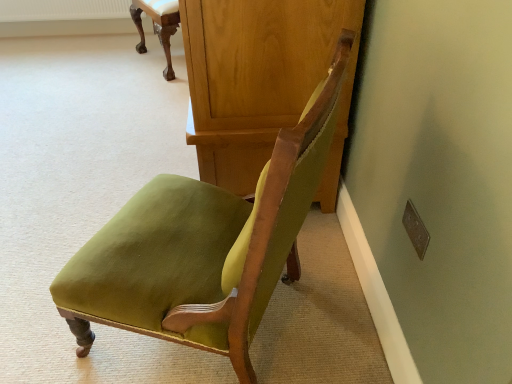
Question: Can you confirm if matte green fabric chair at upper center, which ranks as the 1th chair in back-to-front order, is taller than wooden dresser at center?

Choices:
 (A) yes
 (B) no

Answer: (B)

Question: Is matte green fabric chair at upper center, the second chair from the bottom, far from wooden dresser at center?

Choices:
 (A) yes
 (B) no

Answer: (A)

Question: Considering the relative positions of matte green fabric chair at upper center, which ranks as the 1th chair in back-to-front order, and wooden dresser at center in the image provided, is matte green fabric chair at upper center, which ranks as the 1th chair in back-to-front order, to the right of wooden dresser at center from the viewer's perspective?

Choices:
 (A) no
 (B) yes

Answer: (A)

Question: Is wooden dresser at center a part of matte green fabric chair at upper center, the first chair when ordered from top to bottom?

Choices:
 (A) yes
 (B) no

Answer: (B)

Question: From a real-world perspective, is matte green fabric chair at upper center, the first chair when ordered from top to bottom, located beneath wooden dresser at center?

Choices:
 (A) no
 (B) yes

Answer: (B)

Question: Considering the positions of wooden dresser at center and matte green fabric chair at upper center, the first chair when ordered from top to bottom, in the image, is wooden dresser at center wider or thinner than matte green fabric chair at upper center, the first chair when ordered from top to bottom,?

Choices:
 (A) wide
 (B) thin

Answer: (A)

Question: Based on their positions, is wooden dresser at center located to the left or right of matte green fabric chair at upper center, the second chair from the bottom?

Choices:
 (A) right
 (B) left

Answer: (A)

Question: In terms of size, does wooden dresser at center appear bigger or smaller than matte green fabric chair at upper center, acting as the 2th chair starting from the front?

Choices:
 (A) big
 (B) small

Answer: (A)

Question: Is wooden dresser at center situated inside matte green fabric chair at upper center, the second chair from the bottom, or outside?

Choices:
 (A) outside
 (B) inside

Answer: (A)

Question: Does point (167, 46) appear closer or farther from the camera than point (265, 281)?

Choices:
 (A) farther
 (B) closer

Answer: (A)

Question: In terms of height, does matte green fabric chair at upper center, the second chair from the bottom, look taller or shorter compared to velvet green chair at center, the first chair from the front?

Choices:
 (A) tall
 (B) short

Answer: (B)

Question: In terms of width, does matte green fabric chair at upper center, which ranks as the 1th chair in back-to-front order, look wider or thinner when compared to velvet green chair at center, which ranks as the 2th chair in top-to-bottom order?

Choices:
 (A) wide
 (B) thin

Answer: (B)

Question: Do you think matte green fabric chair at upper center, the first chair when ordered from top to bottom, is within velvet green chair at center, which ranks as the 2th chair in top-to-bottom order, or outside of it?

Choices:
 (A) outside
 (B) inside

Answer: (A)

Question: Looking at the image, does wooden dresser at center seem bigger or smaller compared to velvet green chair at center, the first chair from the front?

Choices:
 (A) big
 (B) small

Answer: (A)

Question: Considering the positions of wooden dresser at center and velvet green chair at center, which ranks as the 2th chair in top-to-bottom order, in the image, is wooden dresser at center taller or shorter than velvet green chair at center, which ranks as the 2th chair in top-to-bottom order,?

Choices:
 (A) tall
 (B) short

Answer: (B)